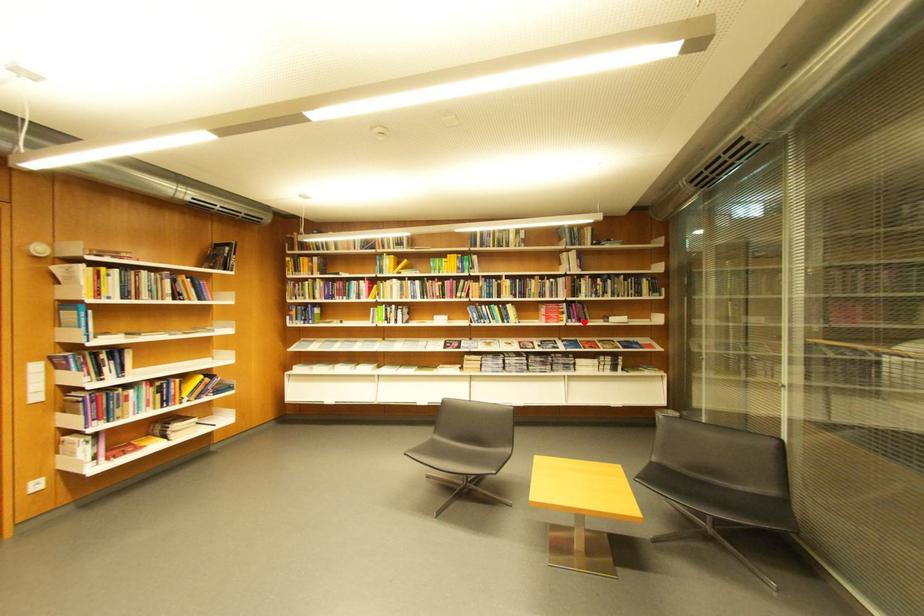
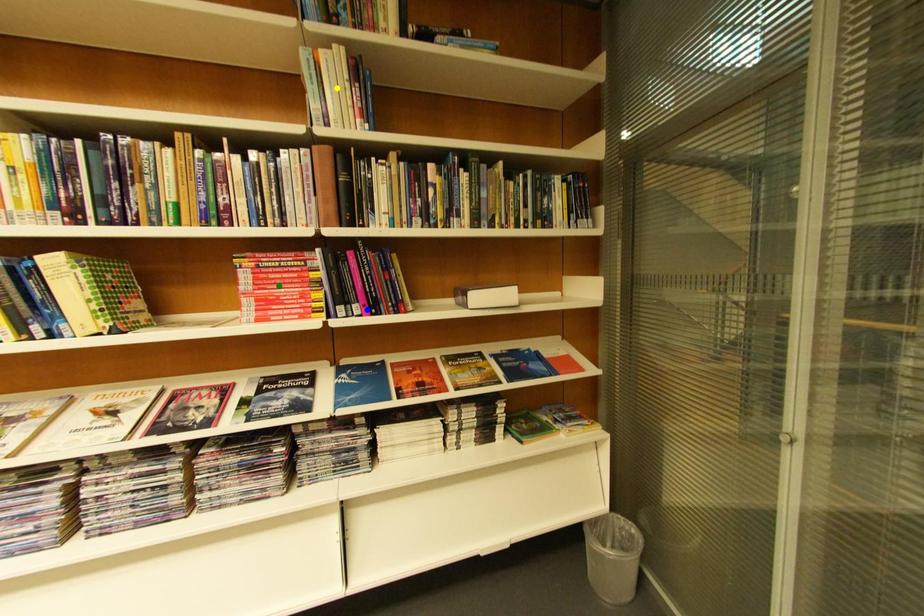
Question: I am providing you with two images of the same scene from different viewpoints. A red point is marked on the first image. You are given multiple points on the second image. Which point in image 2 represents the same 3d spot as the red point in image 1?

Choices:
 (A) green point
 (B) yellow point
 (C) blue point

Answer: (C)